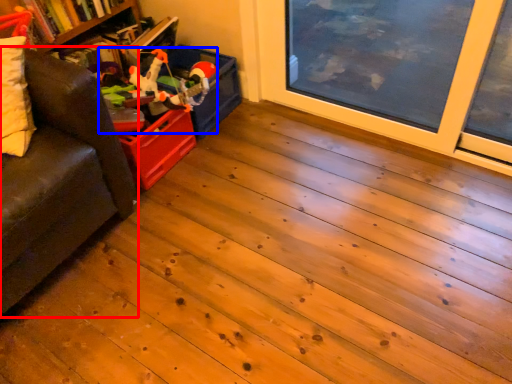
Question: Which of the following is the farthest to the observer, studio couch (highlighted by a red box) or toy (highlighted by a blue box)?

Choices:
 (A) studio couch
 (B) toy

Answer: (B)